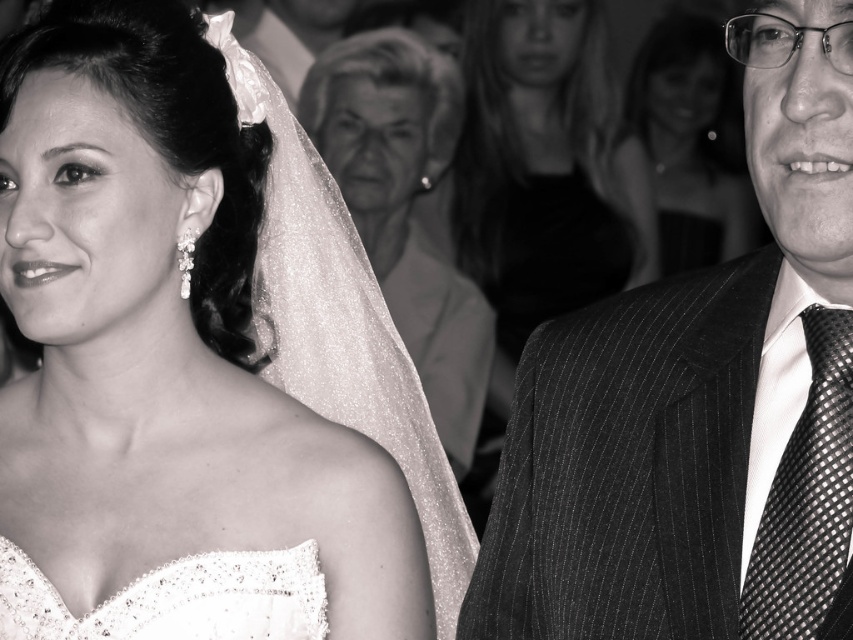
Is glittery white veil at center closer to camera compared to satin lace wedding dress at lower left?

No, glittery white veil at center is further to the viewer.

Can you confirm if glittery white veil at center is positioned above satin lace wedding dress at lower left?

Indeed, glittery white veil at center is positioned over satin lace wedding dress at lower left.

Does point (384, 212) come closer to viewer compared to point (15, 564)?

No, (384, 212) is behind (15, 564).

The image size is (853, 640). Identify the location of glittery white veil at center. (402, 216).

Which of these two, matte white dress at left or glittery white veil at center, stands taller?

Standing taller between the two is glittery white veil at center.

Who is more distant from viewer, (9, 259) or (376, 128)?

Positioned behind is point (376, 128).

Which is behind, point (86, 541) or point (450, 298)?

The point (450, 298) is more distant.

At what (x,y) coordinates should I click in order to perform the action: click on matte white dress at left. Please return your answer as a coordinate pair (x, y). The height and width of the screenshot is (640, 853). Looking at the image, I should click on (164, 333).

Which of these two, glittery white veil at center or smooth skin face at upper right, stands shorter?

smooth skin face at upper right is shorter.

The image size is (853, 640). In order to click on glittery white veil at center in this screenshot , I will do `click(402, 216)`.

Is point (405, 61) closer to camera compared to point (677, 42)?

Yes, point (405, 61) is closer to viewer.

Where is `glittery white veil at center`? The image size is (853, 640). glittery white veil at center is located at coordinates (402, 216).